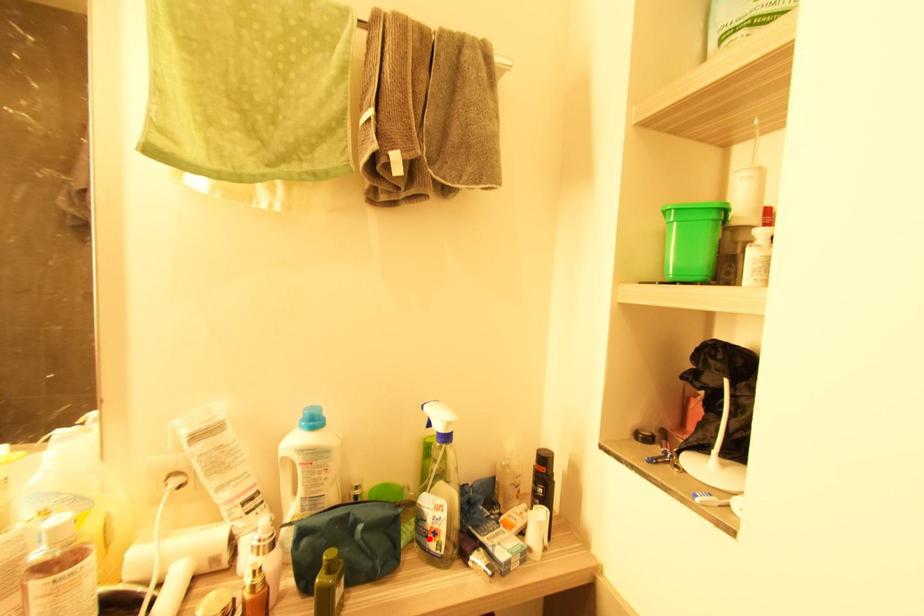
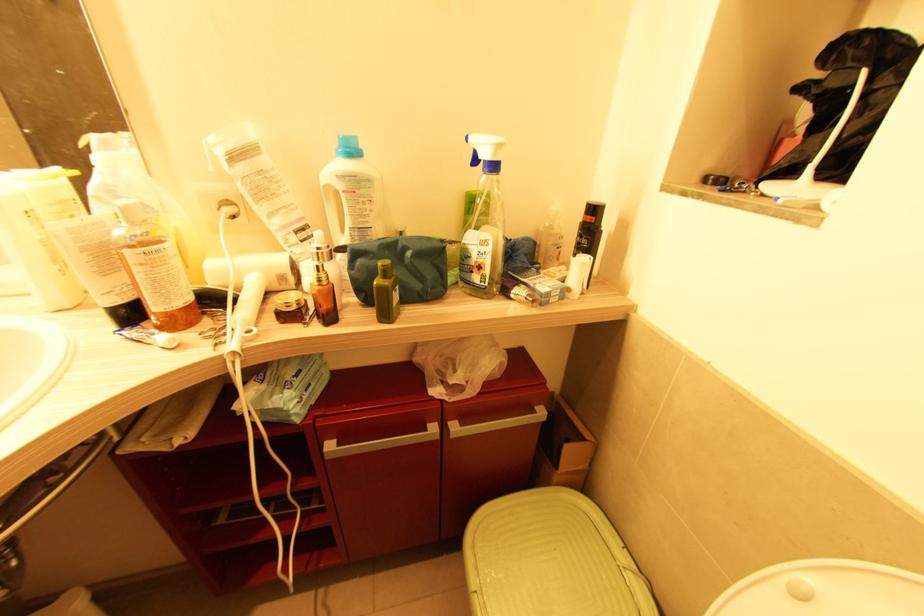
In the second image, find the point that corresponds to the highlighted location in the first image.

(473, 273)